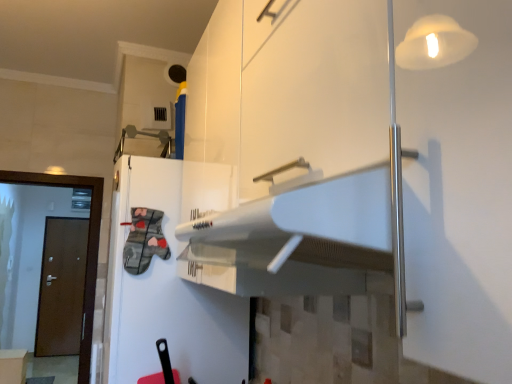
Identify the location of white glossy refrigerator at center. (165, 293).

Describe the element at coordinates (87, 247) in the screenshot. This screenshot has height=384, width=512. I see `brown wooden door at left, the 1th door viewed from the front` at that location.

At what (x,y) coordinates should I click in order to perform the action: click on brown wooden door at left, the 1th door viewed from the right. Please return your answer as a coordinate pair (x, y). Image resolution: width=512 pixels, height=384 pixels. Looking at the image, I should click on (87, 247).

What are the coordinates of `white glossy refrigerator at center` in the screenshot? It's located at (165, 293).

What's the angular difference between white glossy cabinet at upper center, the second cabinetry when ordered from bottom to top, and white glossy cabinet at lower left, marked as the second cabinetry in a right-to-left arrangement,'s facing directions?

They differ by 179 degrees in their facing directions.

This screenshot has width=512, height=384. I want to click on cabinetry located on the left of white glossy cabinet at upper center, marked as the second cabinetry in a left-to-right arrangement, so click(x=13, y=366).

Is white glossy cabinet at upper center, marked as the second cabinetry in a left-to-right arrangement, beside white glossy cabinet at lower left, marked as the second cabinetry in a right-to-left arrangement?

white glossy cabinet at upper center, marked as the second cabinetry in a left-to-right arrangement, and white glossy cabinet at lower left, marked as the second cabinetry in a right-to-left arrangement, are clearly separated.

Can you confirm if white glossy cabinet at upper center, acting as the second cabinetry starting from the back, is bigger than white glossy cabinet at lower left, the second cabinetry when ordered from front to back?

Indeed, white glossy cabinet at upper center, acting as the second cabinetry starting from the back, has a larger size compared to white glossy cabinet at lower left, the second cabinetry when ordered from front to back.

Which is behind, point (95, 286) or point (8, 369)?

The point (8, 369) is farther.

Would you consider brown wooden door at left, the second door when ordered from back to front, to be distant from white glossy cabinet at lower left, positioned as the first cabinetry in back-to-front order?

Yes, brown wooden door at left, the second door when ordered from back to front, and white glossy cabinet at lower left, positioned as the first cabinetry in back-to-front order, are quite far apart.

Measure the distance between brown wooden door at left, the second door when ordered from back to front, and white glossy cabinet at lower left, which ranks as the 2th cabinetry in top-to-bottom order.

brown wooden door at left, the second door when ordered from back to front, and white glossy cabinet at lower left, which ranks as the 2th cabinetry in top-to-bottom order, are 2.03 meters apart.

From the picture: Can you tell me how much brown wooden door at left, the 1th door viewed from the front, and white glossy cabinet at lower left, which appears as the first cabinetry when viewed from the left, differ in facing direction?

The angular difference between brown wooden door at left, the 1th door viewed from the front, and white glossy cabinet at lower left, which appears as the first cabinetry when viewed from the left, is 90.9 degrees.

Can you confirm if brown wooden door at left, which is counted as the second door, starting from the front, is thinner than white glossy cabinet at upper center, acting as the second cabinetry starting from the back?

Yes, brown wooden door at left, which is counted as the second door, starting from the front, is thinner than white glossy cabinet at upper center, acting as the second cabinetry starting from the back.

Would you consider brown wooden door at left, the 2th door from the right, to be distant from white glossy cabinet at upper center, marked as the second cabinetry in a left-to-right arrangement?

Yes.

Which is behind, point (65, 279) or point (357, 374)?

The point (65, 279) is farther.

Does white glossy cabinet at lower left, placed as the 1th cabinetry when sorted from bottom to top, have a greater height compared to brown wooden door at left, the 2th door from the right?

Incorrect, the height of white glossy cabinet at lower left, placed as the 1th cabinetry when sorted from bottom to top, is not larger of that of brown wooden door at left, the 2th door from the right.

Looking at the image, does white glossy cabinet at lower left, marked as the second cabinetry in a right-to-left arrangement, seem bigger or smaller compared to brown wooden door at left, which is counted as the second door, starting from the front?

Considering their sizes, white glossy cabinet at lower left, marked as the second cabinetry in a right-to-left arrangement, takes up less space than brown wooden door at left, which is counted as the second door, starting from the front.

Between white glossy cabinet at lower left, marked as the second cabinetry in a right-to-left arrangement, and brown wooden door at left, placed as the first door when sorted from back to front, which one has smaller width?

brown wooden door at left, placed as the first door when sorted from back to front.

Does brown wooden door at left, placed as the first door when sorted from back to front, have a greater width compared to white glossy refrigerator at center?

No.

Considering the relative positions of brown wooden door at left, the 1th door when ordered from left to right, and white glossy refrigerator at center in the image provided, is brown wooden door at left, the 1th door when ordered from left to right, to the left of white glossy refrigerator at center from the viewer's perspective?

Correct, you'll find brown wooden door at left, the 1th door when ordered from left to right, to the left of white glossy refrigerator at center.

Is white glossy refrigerator at center completely or partially inside brown wooden door at left, placed as the first door when sorted from back to front?

No.

From the image's perspective, is brown wooden door at left, placed as the first door when sorted from back to front, above white glossy refrigerator at center?

No, from the image's perspective, brown wooden door at left, placed as the first door when sorted from back to front, is not over white glossy refrigerator at center.

From the image's perspective, is white glossy cabinet at upper center, the second cabinetry when ordered from bottom to top, over white glossy refrigerator at center?

Yes, from the image's perspective, white glossy cabinet at upper center, the second cabinetry when ordered from bottom to top, is above white glossy refrigerator at center.

Considering the relative positions of white glossy cabinet at upper center, marked as the second cabinetry in a left-to-right arrangement, and white glossy refrigerator at center in the image provided, is white glossy cabinet at upper center, marked as the second cabinetry in a left-to-right arrangement, to the left or to the right of white glossy refrigerator at center?

In the image, white glossy cabinet at upper center, marked as the second cabinetry in a left-to-right arrangement, appears on the right side of white glossy refrigerator at center.

Relative to white glossy refrigerator at center, is white glossy cabinet at upper center, which is counted as the 1th cabinetry, starting from the top, in front or behind?

white glossy cabinet at upper center, which is counted as the 1th cabinetry, starting from the top, is in front of white glossy refrigerator at center.

Does point (145, 204) lie in front of point (474, 106)?

No.

Is white glossy refrigerator at center bigger or smaller than white glossy cabinet at upper center, marked as the second cabinetry in a left-to-right arrangement?

In the image, white glossy refrigerator at center appears to be larger than white glossy cabinet at upper center, marked as the second cabinetry in a left-to-right arrangement.

Is white glossy refrigerator at center located outside white glossy cabinet at upper center, marked as the second cabinetry in a left-to-right arrangement?

Yes, white glossy refrigerator at center is located beyond the bounds of white glossy cabinet at upper center, marked as the second cabinetry in a left-to-right arrangement.

The height and width of the screenshot is (384, 512). I want to click on fridge below the white glossy cabinet at upper center, the second cabinetry when ordered from bottom to top (from the image's perspective), so click(165, 293).

The width and height of the screenshot is (512, 384). In the image, there is a white glossy cabinet at upper center, which is the first cabinetry in right-to-left order. In order to click on cabinetry below it (from a real-world perspective) in this screenshot , I will do `click(13, 366)`.

From the image's perspective, which door is the 2nd one above the white glossy cabinet at lower left, positioned as the first cabinetry in back-to-front order? Please provide its 2D coordinates.

[(87, 247)]

Looking at the image, which one is located closer to white glossy refrigerator at center, brown wooden door at left, the 1th door viewed from the front, or white glossy cabinet at upper center, acting as the second cabinetry starting from the back?

Based on the image, white glossy cabinet at upper center, acting as the second cabinetry starting from the back, appears to be nearer to white glossy refrigerator at center.

From the image, which object appears to be farther from white glossy cabinet at upper center, acting as the second cabinetry starting from the back, brown wooden door at left, placed as the first door when sorted from back to front, or brown wooden door at left, the 1th door viewed from the front?

brown wooden door at left, placed as the first door when sorted from back to front, is further to white glossy cabinet at upper center, acting as the second cabinetry starting from the back.

From the image, which object appears to be farther from white glossy cabinet at upper center, which is counted as the 1th cabinetry, starting from the top, brown wooden door at left, the 1th door viewed from the front, or brown wooden door at left, the 1th door when ordered from left to right?

brown wooden door at left, the 1th door when ordered from left to right, is positioned further to the anchor white glossy cabinet at upper center, which is counted as the 1th cabinetry, starting from the top.

In the scene shown: From the image, which object appears to be farther from white glossy cabinet at lower left, which appears as the first cabinetry when viewed from the left, white glossy refrigerator at center or brown wooden door at left, the 1th door viewed from the front?

Based on the image, white glossy refrigerator at center appears to be further to white glossy cabinet at lower left, which appears as the first cabinetry when viewed from the left.

From the image, which object appears to be nearer to brown wooden door at left, the 1th door when ordered from left to right, white glossy cabinet at upper center, which is counted as the first cabinetry, starting from the front, or brown wooden door at left, acting as the 2th door starting from the left?

brown wooden door at left, acting as the 2th door starting from the left, is closer to brown wooden door at left, the 1th door when ordered from left to right.

From the image, which object appears to be farther from white glossy refrigerator at center, brown wooden door at left, which is counted as the second door, starting from the front, or brown wooden door at left, the second door when ordered from back to front?

brown wooden door at left, which is counted as the second door, starting from the front, lies further to white glossy refrigerator at center than the other object.

Based on their spatial positions, is white glossy refrigerator at center or white glossy cabinet at upper center, which is counted as the first cabinetry, starting from the front, closer to brown wooden door at left, the second door when ordered from back to front?

Among the two, white glossy refrigerator at center is located nearer to brown wooden door at left, the second door when ordered from back to front.

Based on their spatial positions, is white glossy refrigerator at center or brown wooden door at left, acting as the 2th door starting from the left, closer to brown wooden door at left, the 1th door when ordered from left to right?

The object closer to brown wooden door at left, the 1th door when ordered from left to right, is brown wooden door at left, acting as the 2th door starting from the left.

Identify the location of cabinetry located between white glossy refrigerator at center and brown wooden door at left, which is counted as the second door, starting from the front, in the depth direction. (13, 366).

Image resolution: width=512 pixels, height=384 pixels. I want to click on fridge located between white glossy cabinet at upper center, the second cabinetry when ordered from bottom to top, and brown wooden door at left, the 1th door viewed from the right, in the depth direction, so click(x=165, y=293).

Identify the location of fridge positioned between white glossy cabinet at upper center, acting as the second cabinetry starting from the back, and brown wooden door at left, the 1th door when ordered from left to right, from near to far. (165, 293).

At what (x,y) coordinates should I click in order to perform the action: click on fridge between white glossy cabinet at upper center, acting as the second cabinetry starting from the back, and white glossy cabinet at lower left, which ranks as the 2th cabinetry in top-to-bottom order, from front to back. Please return your answer as a coordinate pair (x, y). Looking at the image, I should click on (165, 293).